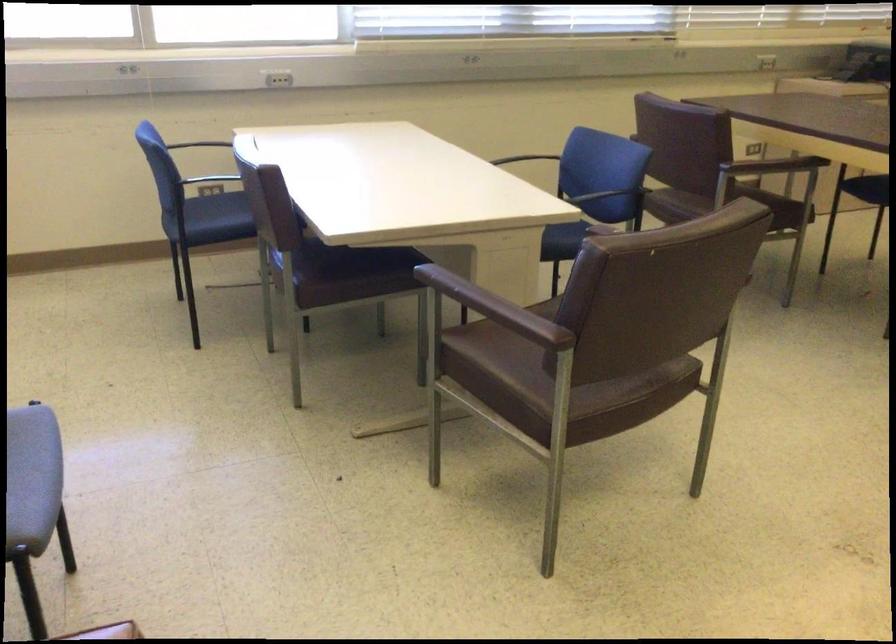
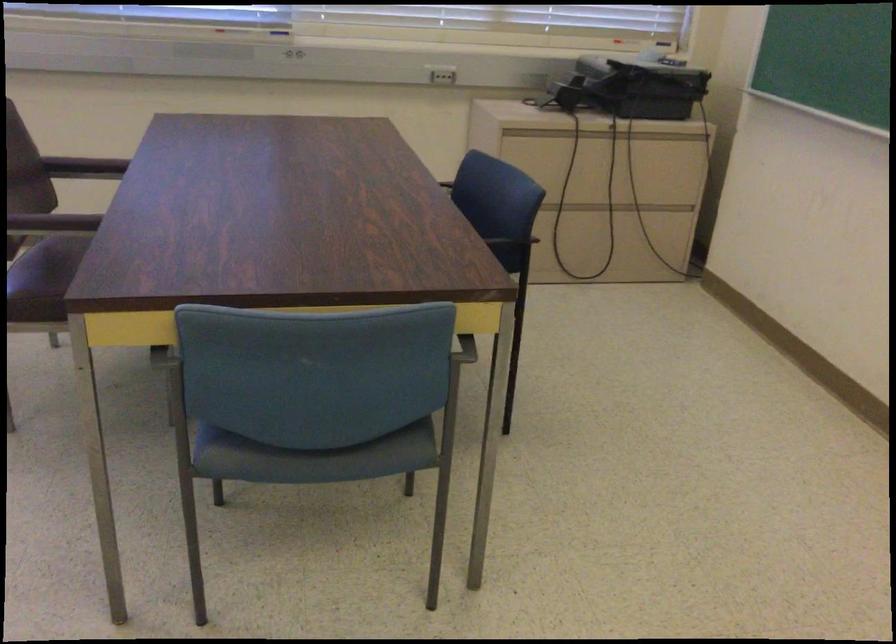
The images are taken continuously from a first-person perspective. In which direction are you moving?

The cameraman walked toward right, forward.